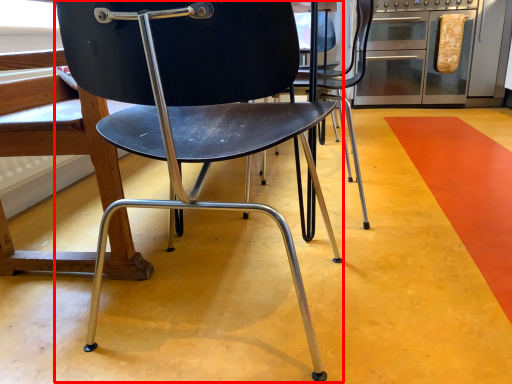
Question: Where is chair (annotated by the red box) located in relation to oven in the image?

Choices:
 (A) right
 (B) left

Answer: (B)